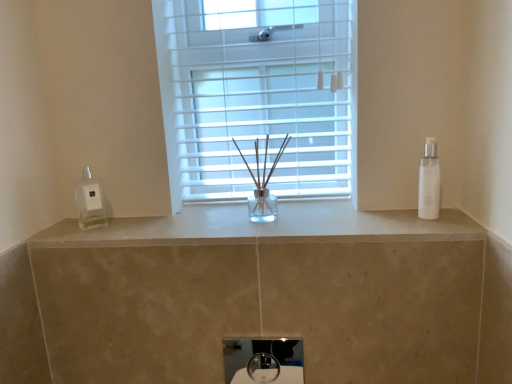
Locate an element on the screen. The height and width of the screenshot is (384, 512). vacant area located to the right-hand side of white glossy soap dispenser at left is located at coordinates (152, 218).